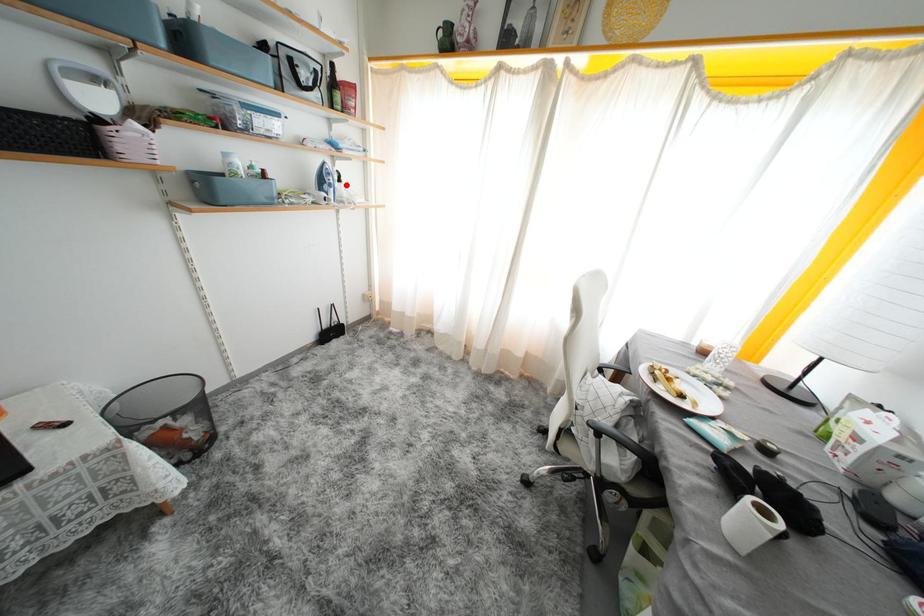
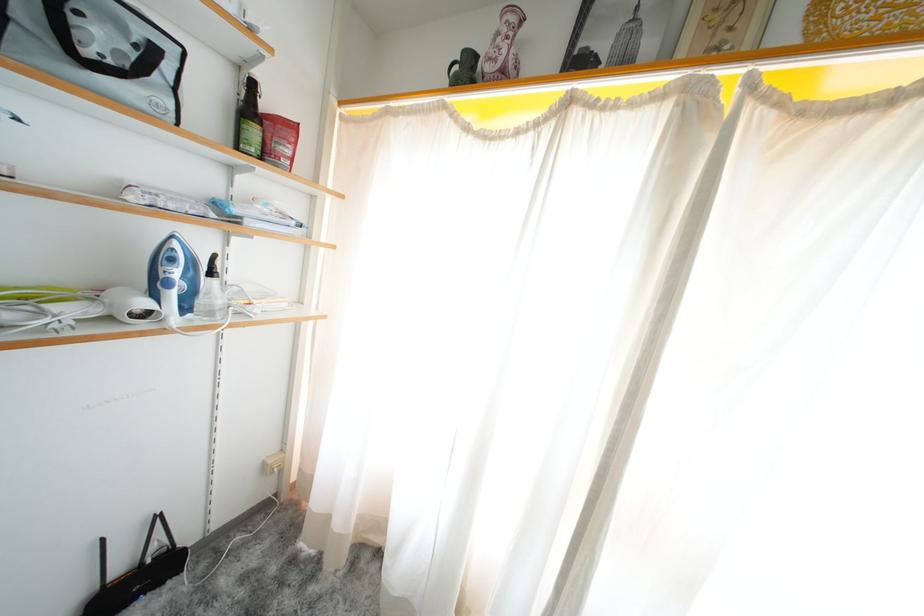
Find the pixel in the second image that matches the highlighted location in the first image.

(217, 278)